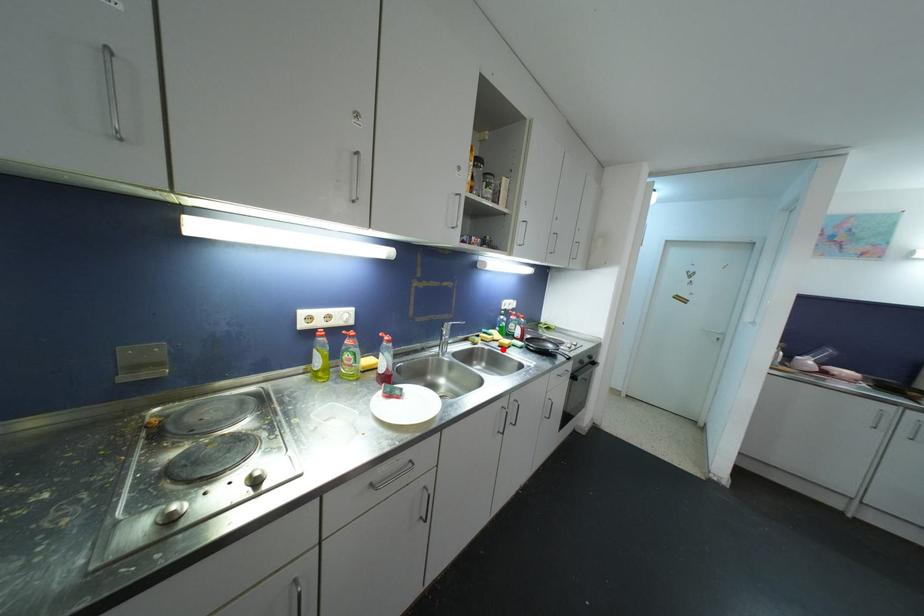
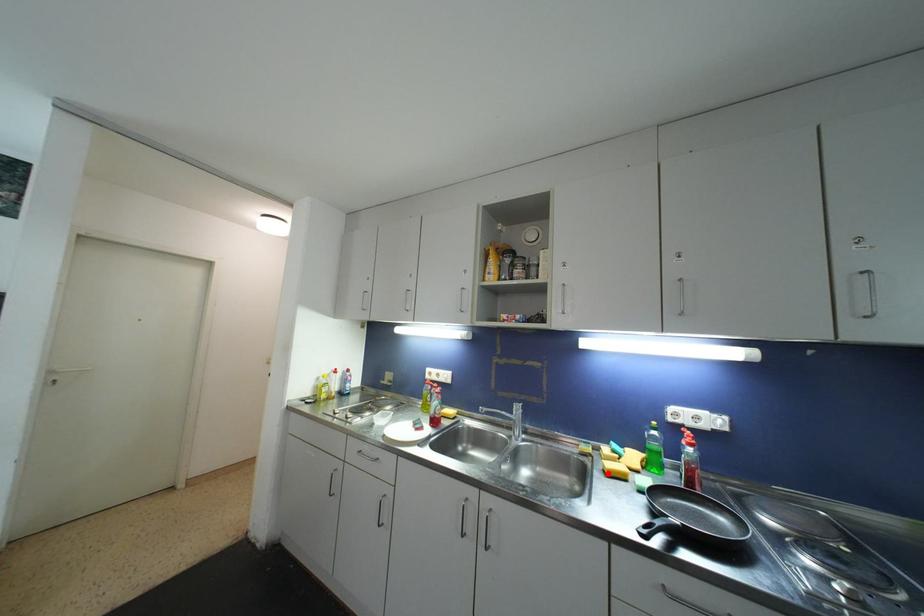
I am providing you with two images of the same scene from different viewpoints. A red point is marked on the first image and another point is marked on the second image. Do the highlighted points in image1 and image2 indicate the same real-world spot?

Yes